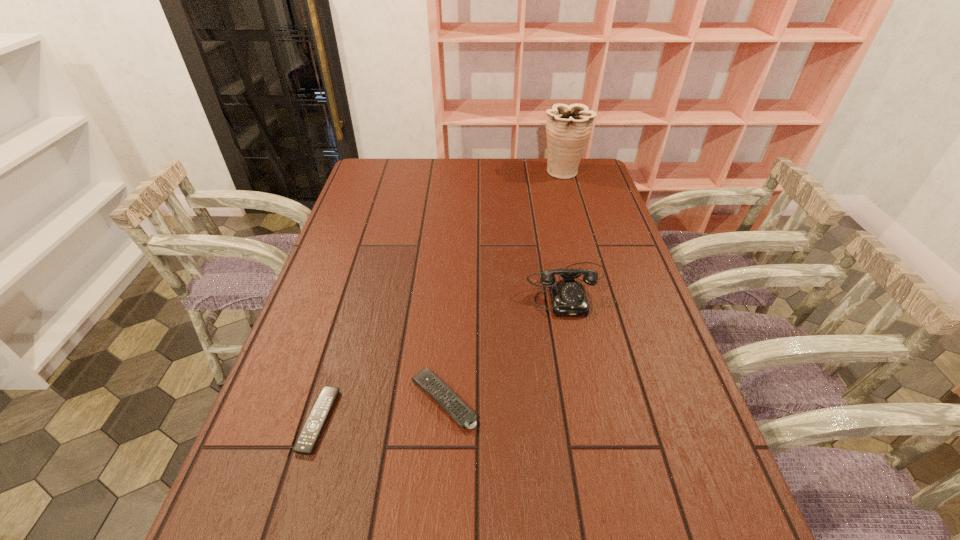
The width and height of the screenshot is (960, 540). What are the coordinates of `vacant space at the far left corner` in the screenshot? It's located at (369, 189).

Image resolution: width=960 pixels, height=540 pixels. I want to click on vacant space at the far right corner of the desktop, so 574,179.

Locate an element on the screen. vacant space that is in between the tallest object and the telephone is located at coordinates (565, 230).

Identify the location of free space between the tallest object and the telephone. (565, 230).

The height and width of the screenshot is (540, 960). In order to click on free area in between the left remote control and the third nearest object in this screenshot , I will do `click(444, 354)`.

Where is `vacant region between the tallest object and the taller remote control`? vacant region between the tallest object and the taller remote control is located at coordinates (503, 286).

The image size is (960, 540). I want to click on free space between the third shortest object and the farthest object, so click(x=565, y=230).

At what (x,y) coordinates should I click in order to perform the action: click on vacant point located between the urn and the third shortest object. Please return your answer as a coordinate pair (x, y). Looking at the image, I should click on (565, 230).

Identify the location of vacant area that lies between the telephone and the farthest object. (565, 230).

Find the location of `vacant space in between the farthest object and the third object from right to left`. vacant space in between the farthest object and the third object from right to left is located at coordinates (503, 286).